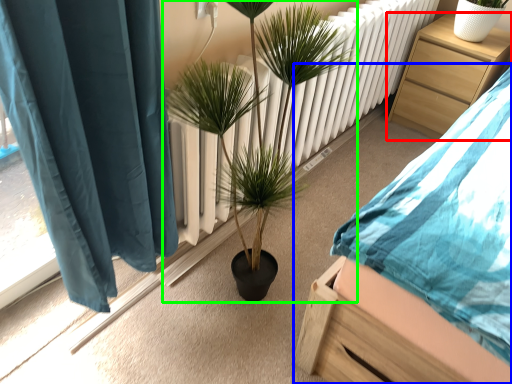
Question: Which object is the farthest from nightstand (highlighted by a red box)? Choose among these: bed (highlighted by a blue box) or houseplant (highlighted by a green box).

Choices:
 (A) bed
 (B) houseplant

Answer: (B)